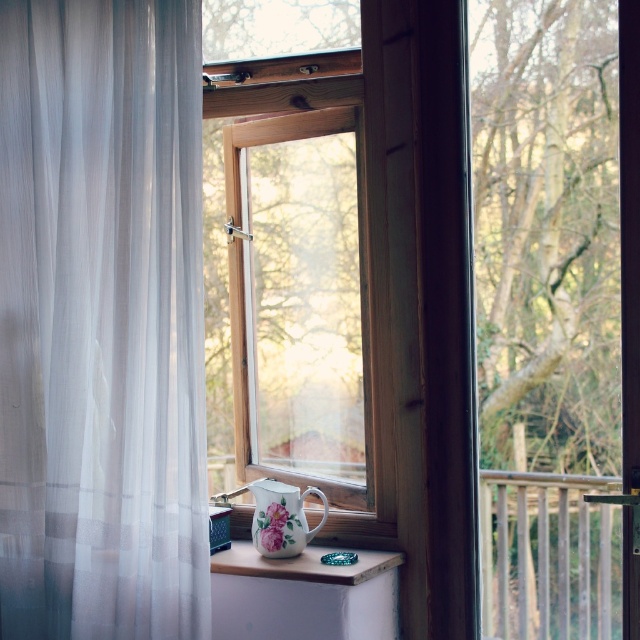
Question: Which object is the closest to the white sheer curtain at left?

Choices:
 (A) wooden railing at right
 (B) porcelain floral mug at lower center
 (C) porcelain floral pitcher at center
 (D) white wood at center

Answer: (D)

Question: Can you confirm if white sheer curtain at left is positioned above porcelain floral mug at lower center?

Choices:
 (A) no
 (B) yes

Answer: (B)

Question: Does white sheer curtain at left lie in front of porcelain floral pitcher at center?

Choices:
 (A) no
 (B) yes

Answer: (A)

Question: Which point appears farthest from the camera in this image?

Choices:
 (A) (557, 483)
 (B) (189, 627)

Answer: (A)

Question: Is wooden railing at right positioned behind white wood at center?

Choices:
 (A) yes
 (B) no

Answer: (B)

Question: Which point is closer to the camera?

Choices:
 (A) (381, 552)
 (B) (518, 502)
 (C) (296, 563)

Answer: (B)